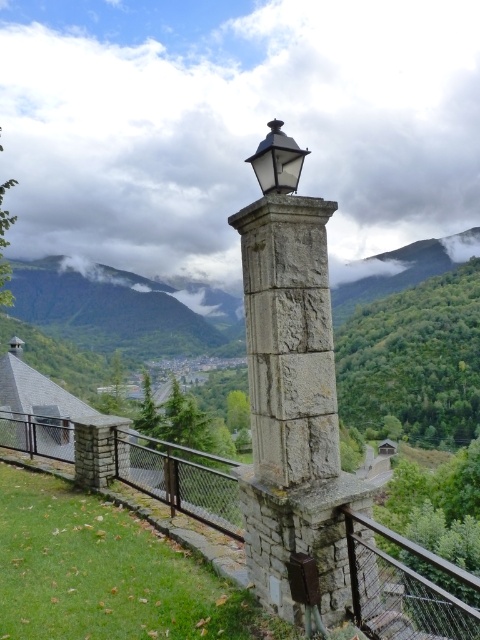
Can you confirm if rusty metal fence at center is positioned to the right of matte black lantern at upper center?

No, rusty metal fence at center is not to the right of matte black lantern at upper center.

Identify the location of rusty metal fence at center. This screenshot has width=480, height=640. (407, 586).